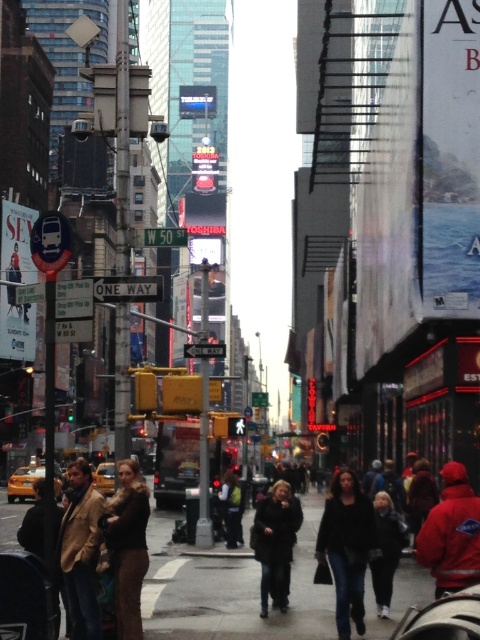
Can you confirm if black leather coat at lower right is bigger than dark blue jeans at center?

No, black leather coat at lower right is not bigger than dark blue jeans at center.

Is black leather coat at lower right further to the viewer compared to dark blue jeans at center?

No, it is not.

Measure the distance between black leather coat at lower right and camera.

black leather coat at lower right and camera are 15.75 meters apart.

Locate an element on the screen. Image resolution: width=480 pixels, height=640 pixels. black leather coat at lower right is located at coordinates (347, 547).

Who is taller, brown fuzzy coat at lower left or dark blue jacket at center?

With more height is brown fuzzy coat at lower left.

Between brown fuzzy coat at lower left and dark blue jacket at center, which one appears on the left side from the viewer's perspective?

Positioned to the left is brown fuzzy coat at lower left.

I want to click on brown fuzzy coat at lower left, so click(x=128, y=545).

Measure the distance between smooth asphalt pavement at lower center and camera.

smooth asphalt pavement at lower center is 50.08 feet away from camera.

Which is in front, point (165, 538) or point (124, 534)?

Point (124, 534) is more forward.

Which is behind, point (331, 627) or point (135, 461)?

Point (331, 627)

Locate an element on the screen. This screenshot has height=640, width=480. smooth asphalt pavement at lower center is located at coordinates (230, 588).